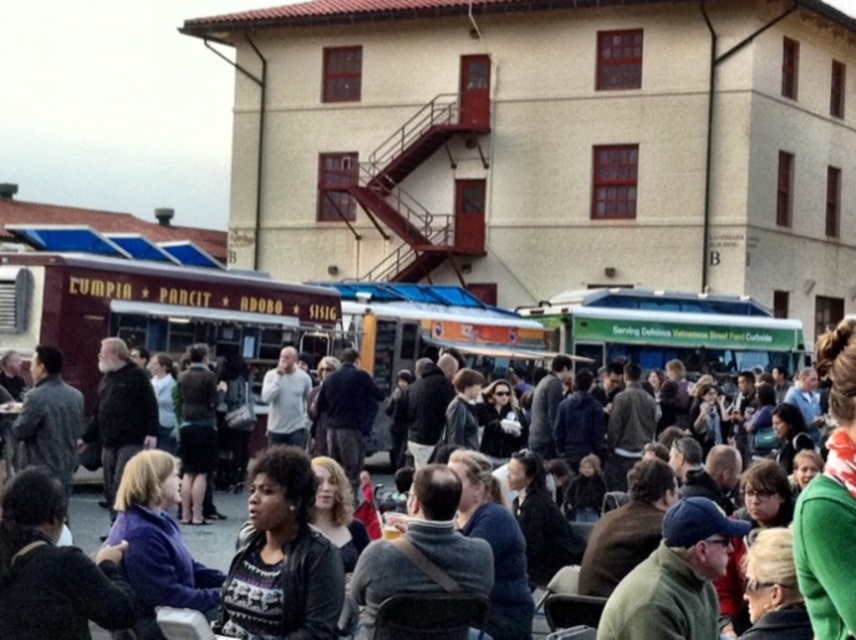
Is matte red food truck at center below dark gray jacket at center?

Incorrect, matte red food truck at center is not positioned below dark gray jacket at center.

At what (x,y) coordinates should I click in order to perform the action: click on matte red food truck at center. Please return your answer as a coordinate pair (x, y). The width and height of the screenshot is (856, 640). Looking at the image, I should click on (153, 310).

Who is more forward, (169, 308) or (229, 547)?

Point (229, 547) is more forward.

In order to click on matte red food truck at center in this screenshot , I will do `click(153, 310)`.